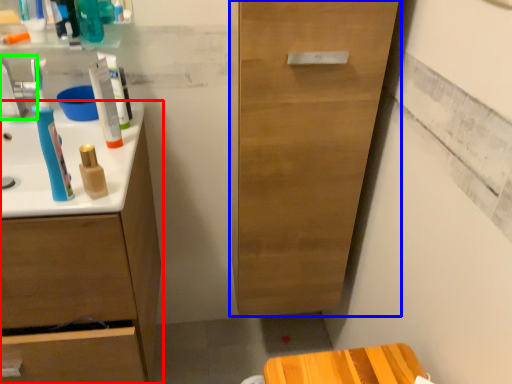
Question: Which object is the farthest from bathroom cabinet (highlighted by a red box)? Choose among these: cabinetry (highlighted by a blue box) or faucet (highlighted by a green box).

Choices:
 (A) cabinetry
 (B) faucet

Answer: (A)